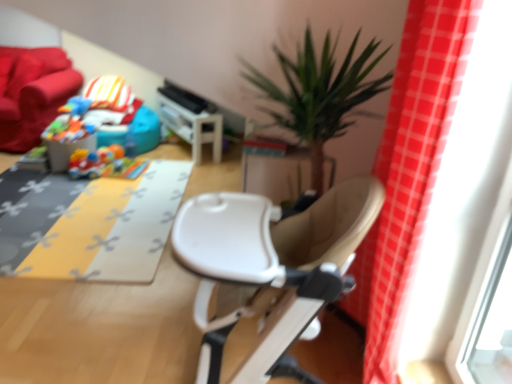
Question: Is plastic colorful car at center, arranged as the 2th toy when viewed from the left, taller or shorter than white plastic table at center?

Choices:
 (A) short
 (B) tall

Answer: (A)

Question: Is plastic colorful car at center, which is the first toy from right to left, in front of or behind white plastic table at center in the image?

Choices:
 (A) front
 (B) behind

Answer: (A)

Question: Which object is positioned farthest from the red plaid curtain at right?

Choices:
 (A) velvet red couch at upper left
 (B) rubberized blue toy at upper left, positioned as the 1th toy in top-to-bottom order
 (C) yellow fabric mat at center
 (D) white plastic table at center
 (E) plastic colorful car at center, arranged as the 2th toy when viewed from the left

Answer: (A)

Question: Estimate the real-world distances between objects in this image. Which object is closer to the white plastic chair at center?

Choices:
 (A) yellow fabric mat at center
 (B) red plaid curtain at right
 (C) white plastic table at center
 (D) plastic colorful car at center, marked as the second toy in a top-to-bottom arrangement
 (E) rubberized blue toy at upper left, the 2th toy in the right-to-left sequence

Answer: (B)